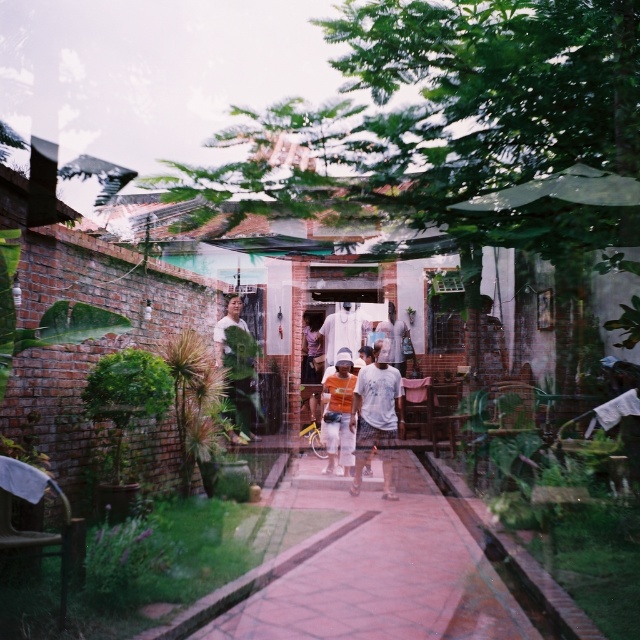
Does brick paved path at center appear on the right side of orange cotton shirt at center?

Incorrect, brick paved path at center is not on the right side of orange cotton shirt at center.

This screenshot has width=640, height=640. Find the location of `brick paved path at center`. brick paved path at center is located at coordinates (371, 572).

I want to click on brick paved path at center, so click(x=371, y=572).

Who is more forward, (216, 328) or (346, 321)?

Point (216, 328)

Which is behind, point (234, 323) or point (326, 316)?

Point (326, 316)

The height and width of the screenshot is (640, 640). What are the coordinates of `matte green shirt at center` in the screenshot? It's located at (236, 362).

Does white cotton shirt at center lie behind orange cotton shirt at center?

No.

Does point (358, 387) lie behind point (326, 380)?

No, (358, 387) is closer to viewer.

Which is in front, point (385, 401) or point (340, 420)?

Point (385, 401) is in front.

Identify the location of white cotton shirt at center. (374, 406).